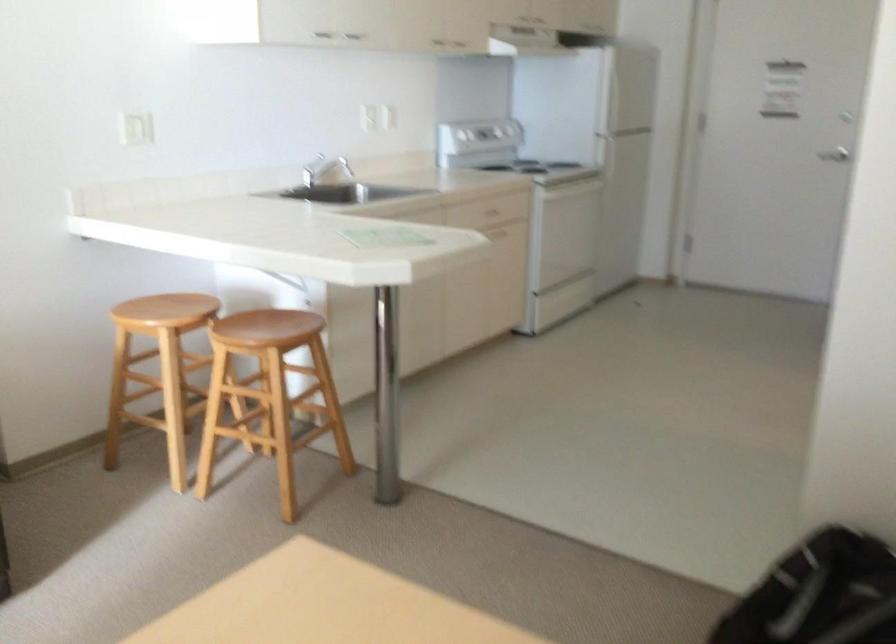
Where would you push the silver faucet handle? Please return your answer as a coordinate pair (x, y).

(317, 171)